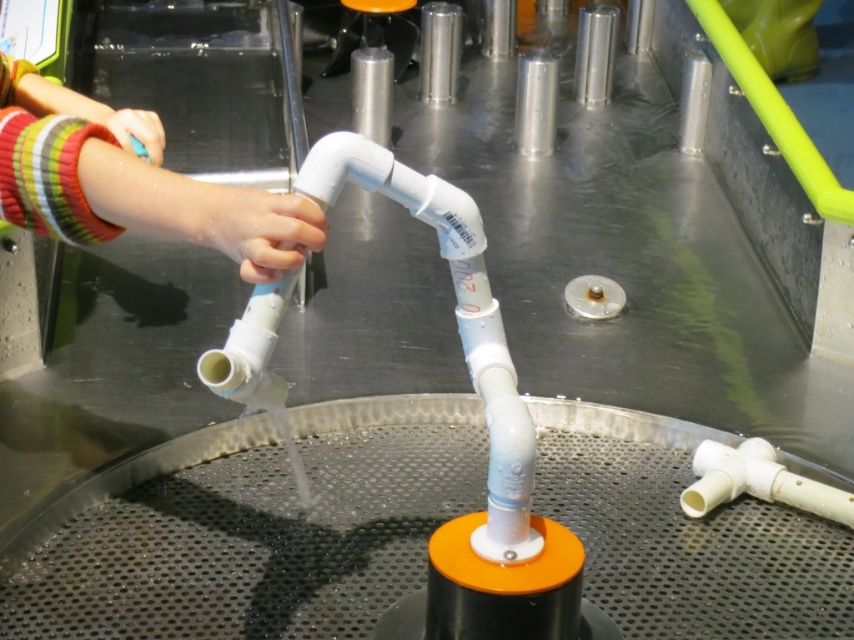
Question: Does white matte hand at center have a greater width compared to matte plastic hand at upper left?

Choices:
 (A) yes
 (B) no

Answer: (B)

Question: Is white matte hand at center above matte plastic hand at upper left?

Choices:
 (A) no
 (B) yes

Answer: (A)

Question: Which object appears farthest from the camera in this image?

Choices:
 (A) matte plastic hand at upper left
 (B) white matte hand at center

Answer: (A)

Question: Which object is farther from the camera taking this photo?

Choices:
 (A) matte plastic hand at upper left
 (B) white matte hand at center

Answer: (A)

Question: Where is white matte hand at center located in relation to matte plastic hand at upper left in the image?

Choices:
 (A) above
 (B) below

Answer: (B)